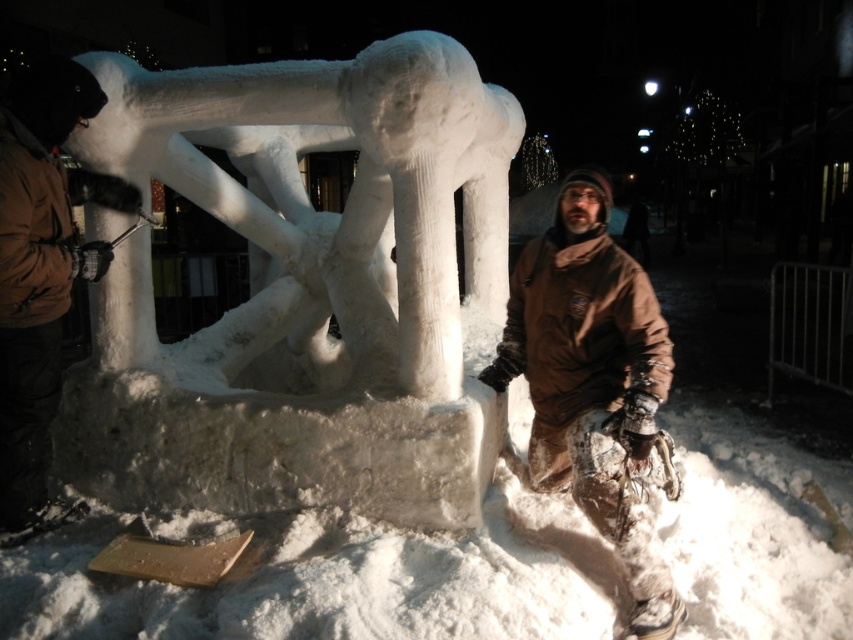
Is brown fuzzy jacket at lower right smaller than brown woolen jacket at left?

Incorrect, brown fuzzy jacket at lower right is not smaller in size than brown woolen jacket at left.

Locate an element on the screen. brown fuzzy jacket at lower right is located at coordinates 593,384.

Where is `brown fuzzy jacket at lower right`? The height and width of the screenshot is (640, 853). brown fuzzy jacket at lower right is located at coordinates (x=593, y=384).

Which is above, white snow sculpture at center or brown fuzzy jacket at lower right?

white snow sculpture at center

Between white snow sculpture at center and brown fuzzy jacket at lower right, which one has less height?

brown fuzzy jacket at lower right

Locate an element on the screen. Image resolution: width=853 pixels, height=640 pixels. white snow sculpture at center is located at coordinates (305, 291).

Does white snow sculpture at center appear on the left side of brown woolen jacket at left?

No, white snow sculpture at center is not to the left of brown woolen jacket at left.

Can you confirm if white snow sculpture at center is positioned to the right of brown woolen jacket at left?

Indeed, white snow sculpture at center is positioned on the right side of brown woolen jacket at left.

Which is in front, point (338, 321) or point (129, 211)?

Point (129, 211) is in front.

You are a GUI agent. You are given a task and a screenshot of the screen. Output one action in this format:
    pyautogui.click(x=<x>, y=<y>)
    Task: Click on the white snow sculpture at center
    
    Given the screenshot: What is the action you would take?
    pyautogui.click(x=305, y=291)